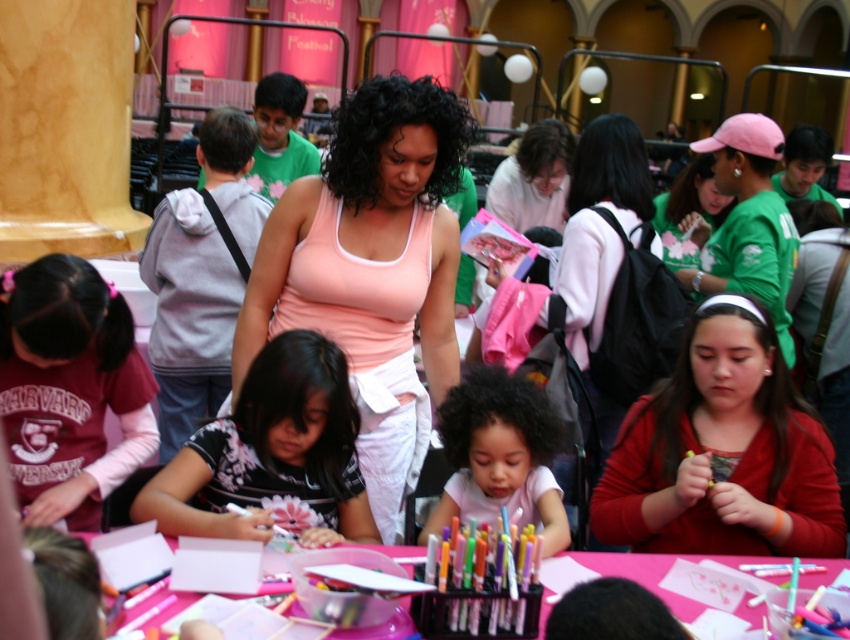
Question: Which object is positioned farthest from the pink paper at center?

Choices:
 (A) matte pink tank top at center
 (B) green jersey at center
 (C) smooth pink shirt at center

Answer: (B)

Question: Observing the image, what is the correct spatial positioning of matte pink tank top at center in reference to floral-patterned shirt at center?

Choices:
 (A) above
 (B) below

Answer: (A)

Question: In this image, where is pink fabric tank top at center located relative to matte pink tank top at center?

Choices:
 (A) left
 (B) right

Answer: (A)

Question: Which point is farther from the camera taking this photo?

Choices:
 (A) (292, 611)
 (B) (684, 468)
 (C) (731, 145)
 (D) (273, 234)

Answer: (C)

Question: Where is smooth pink shirt at center located in relation to pink paper at center in the image?

Choices:
 (A) below
 (B) above

Answer: (B)

Question: Which object is positioned farthest from the pink paper at center?

Choices:
 (A) green jersey at center
 (B) maroon fabric shirt at lower left
 (C) matte pink tank top at center

Answer: (A)